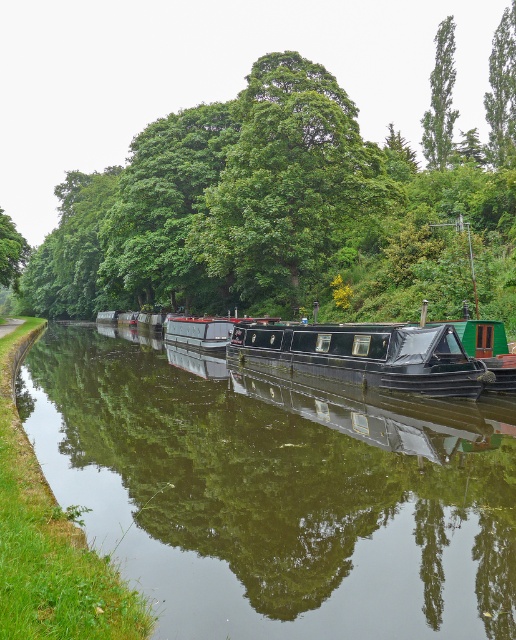
Does black matte boat at center have a lesser width compared to green leafy tree at upper center?

Yes, black matte boat at center is thinner than green leafy tree at upper center.

Is point (373, 384) in front of point (442, 83)?

Yes, it is.

Is point (327, 353) less distant than point (430, 161)?

Yes, it is.

Identify the location of black matte boat at center. The height and width of the screenshot is (640, 516). (365, 355).

Can you confirm if green leafy tree at upper right is taller than green leafy tree at upper center?

No, green leafy tree at upper right is not taller than green leafy tree at upper center.

What do you see at coordinates (502, 90) in the screenshot?
I see `green leafy tree at upper right` at bounding box center [502, 90].

Which is in front, point (505, 113) or point (452, 68)?

Point (505, 113) is in front.

Where is `green leafy tree at upper right`? green leafy tree at upper right is located at coordinates (x=502, y=90).

Based on the photo, who is positioned more to the right, green leafy tree at center or black matte boat at center?

From the viewer's perspective, black matte boat at center appears more on the right side.

Is point (64, 198) positioned behind point (254, 353)?

That is True.

Is point (390, 236) positioned before point (229, 348)?

No.

Where is `green leafy tree at center`? This screenshot has width=516, height=640. green leafy tree at center is located at coordinates (275, 214).